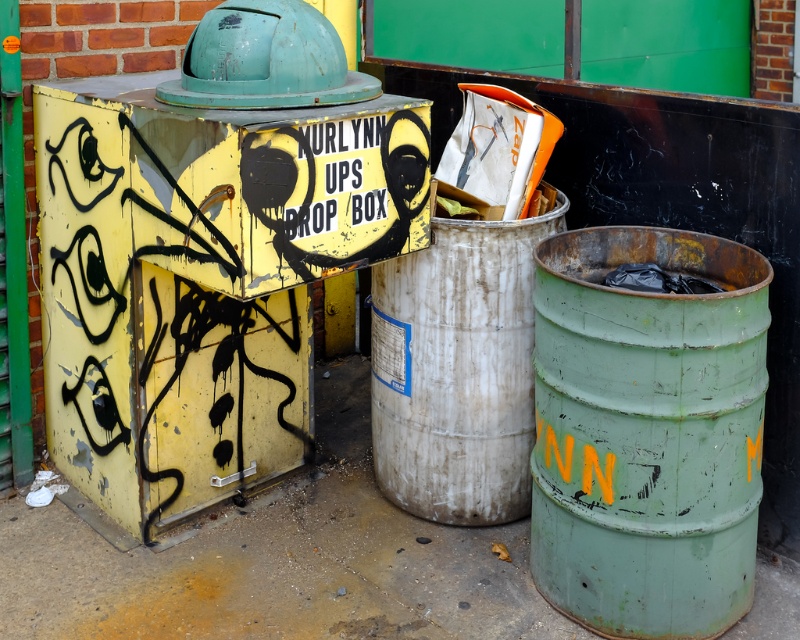
Question: Does green painted metal barrel at right have a smaller size compared to rusty metallic barrel at center?

Choices:
 (A) no
 (B) yes

Answer: (A)

Question: Is green painted metal barrel at right below rusty metallic barrel at center?

Choices:
 (A) no
 (B) yes

Answer: (B)

Question: Can you confirm if green painted metal barrel at right is smaller than rusty metallic barrel at center?

Choices:
 (A) no
 (B) yes

Answer: (A)